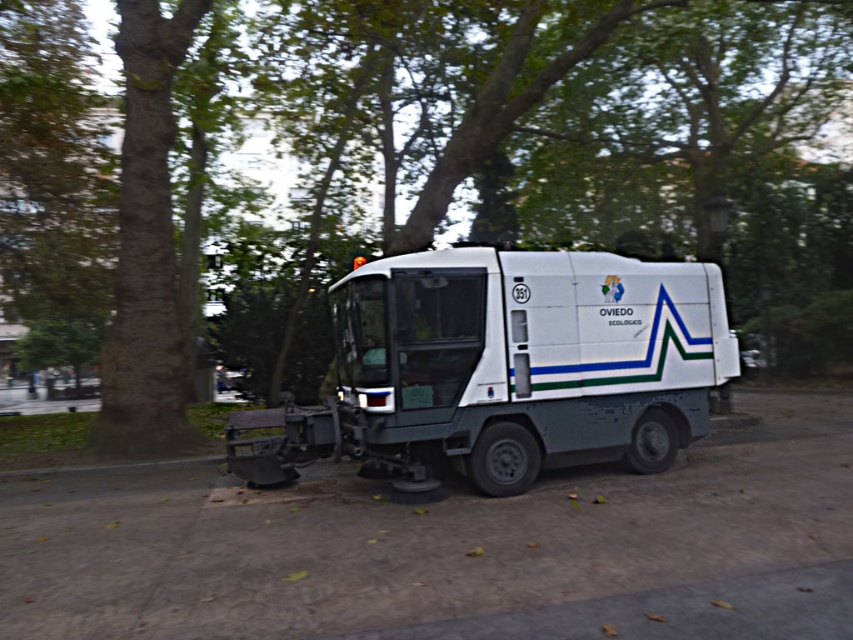
Question: Which point appears farthest from the camera in this image?

Choices:
 (A) (508, 436)
 (B) (288, 33)

Answer: (B)

Question: Observing the image, what is the correct spatial positioning of green leafy tree at center in reference to white matte tow truck at center?

Choices:
 (A) above
 (B) below

Answer: (A)

Question: Does green leafy tree at center appear on the right side of white matte tow truck at center?

Choices:
 (A) yes
 (B) no

Answer: (B)

Question: Which point is farther from the camera taking this photo?

Choices:
 (A) (660, 51)
 (B) (590, 438)

Answer: (A)

Question: Which point appears closest to the camera in this image?

Choices:
 (A) (30, 272)
 (B) (686, 326)

Answer: (B)

Question: Is green leafy tree at center to the left of white matte tow truck at center from the viewer's perspective?

Choices:
 (A) no
 (B) yes

Answer: (B)